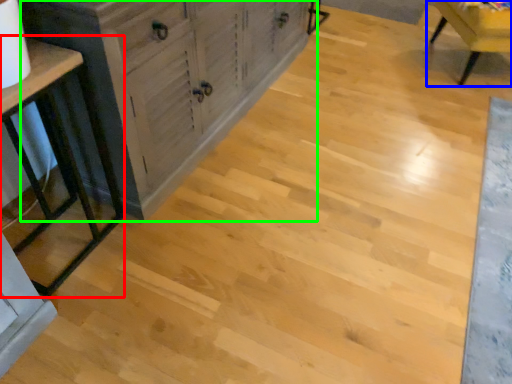
Question: Which object is positioned farthest from table (highlighted by a red box)? Select from chair (highlighted by a blue box) and cabinetry (highlighted by a green box).

Choices:
 (A) chair
 (B) cabinetry

Answer: (A)